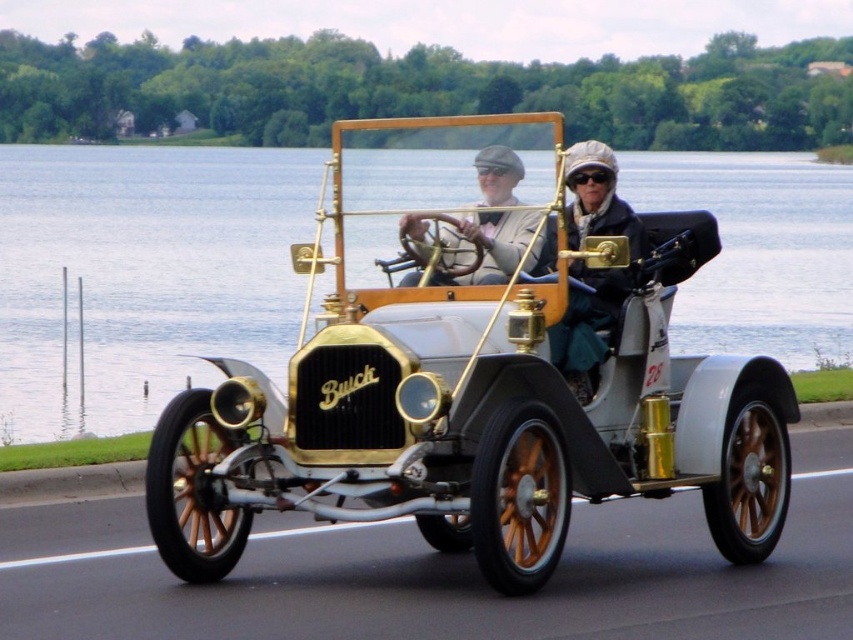
You are a passenger in the white polished wood car at center and want to hand a map to the person wearing the matte black jacket at center. Can you reach them without leaving your seat?

The distance between the white polished wood car at center and the matte black jacket at center is 37.68 inches. Since the average human arm length is about 25 to 35 inches, you might not be able to reach them comfortably without stretching or moving closer.

You are standing in front of the vintage Buick automobile. There are two points marked on the car, one at point coordinates point [538,513] and another at point coordinates point [505,225]. Which point is closer to you?

Point [538,513] is closer to the camera than point [505,225], so the point at coordinates point [538,513] is closer to you.